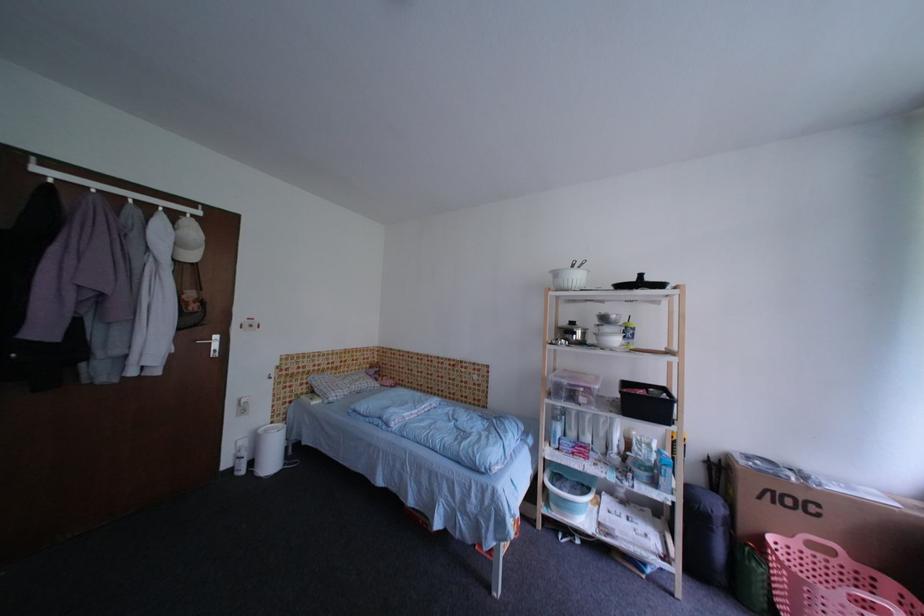
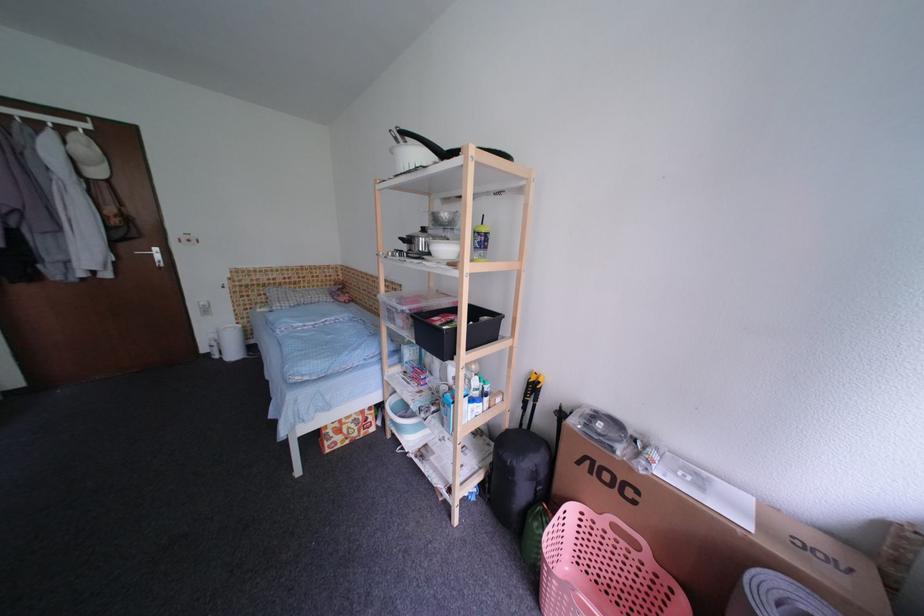
The point at (829, 559) is marked in the first image. Where is the corresponding point in the second image?

(630, 546)